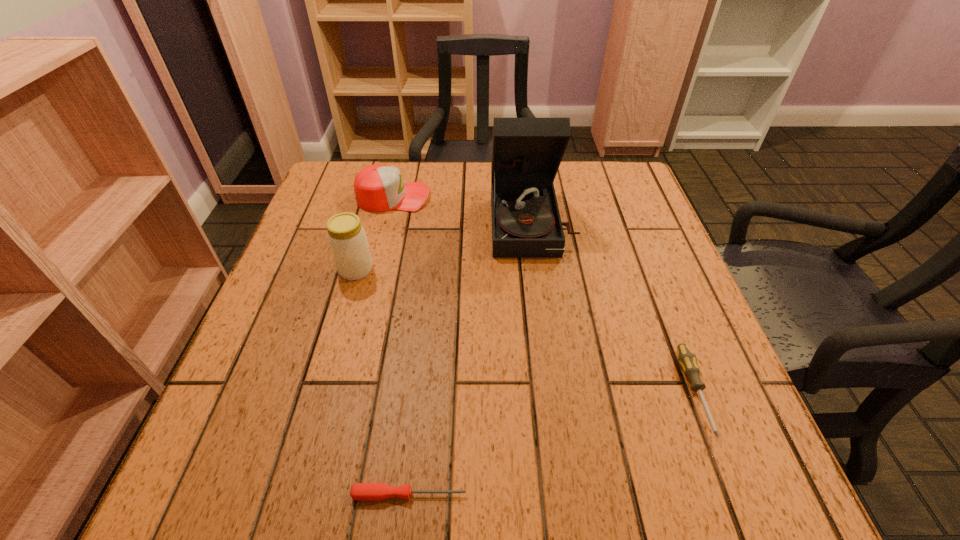
I want to click on vacant space located 0.200m on the front of the second tallest object, so click(329, 362).

Locate an element on the screen. vacant space located 0.160m on the front-facing side of the baseball cap is located at coordinates click(x=492, y=197).

At what (x,y) coordinates should I click in order to perform the action: click on free space located 0.070m at the tip of the rightmost object. Please return your answer as a coordinate pair (x, y). Looking at the image, I should click on (732, 489).

Identify the location of vacant space located 0.050m at the tip of the shorter screwdriver. [501, 495].

At what (x,y) coordinates should I click in order to perform the action: click on phonograph_record positioned at the far edge. Please return your answer as a coordinate pair (x, y). This screenshot has height=540, width=960. Looking at the image, I should click on (526, 152).

Identify the location of baseball cap at the far edge. (378, 188).

At what (x,y) coordinates should I click in order to perform the action: click on jar that is at the left edge. Please return your answer as a coordinate pair (x, y). Looking at the image, I should click on (347, 239).

At what (x,y) coordinates should I click in order to perform the action: click on baseball cap that is positioned at the left edge. Please return your answer as a coordinate pair (x, y). This screenshot has width=960, height=540. Looking at the image, I should click on (378, 188).

Image resolution: width=960 pixels, height=540 pixels. What are the coordinates of `object present at the right edge` in the screenshot? It's located at (686, 358).

The height and width of the screenshot is (540, 960). Identify the location of object located in the far left corner section of the desktop. (378, 188).